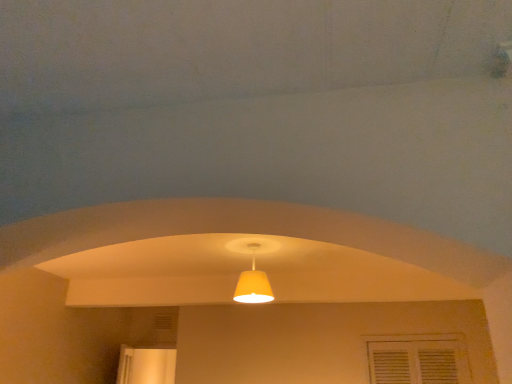
Where is `matte yellow fabric lampshade at center`? The height and width of the screenshot is (384, 512). matte yellow fabric lampshade at center is located at coordinates (253, 283).

Image resolution: width=512 pixels, height=384 pixels. What do you see at coordinates (253, 283) in the screenshot? I see `matte yellow fabric lampshade at center` at bounding box center [253, 283].

Measure the distance between matte yellow fabric lampshade at center and camera.

matte yellow fabric lampshade at center is 8.30 feet from camera.

The width and height of the screenshot is (512, 384). Find the location of `matte yellow fabric lampshade at center`. matte yellow fabric lampshade at center is located at coordinates (253, 283).